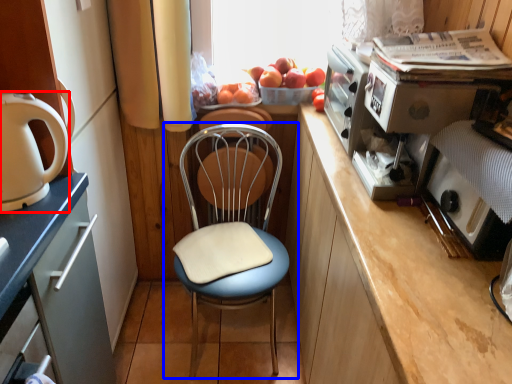
Question: Which point is further to the camera, home appliance (highlighted by a red box) or chair (highlighted by a blue box)?

Choices:
 (A) home appliance
 (B) chair

Answer: (B)